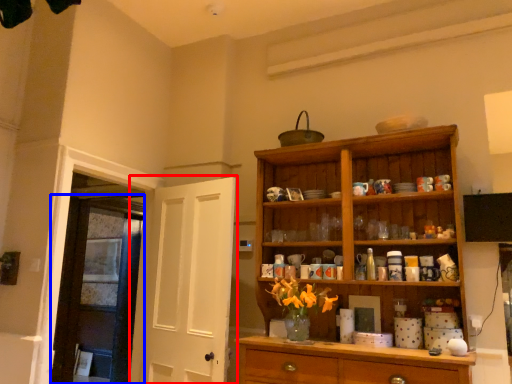
Question: Among these objects, which one is farthest to the camera, door (highlighted by a red box) or door (highlighted by a blue box)?

Choices:
 (A) door
 (B) door

Answer: (B)